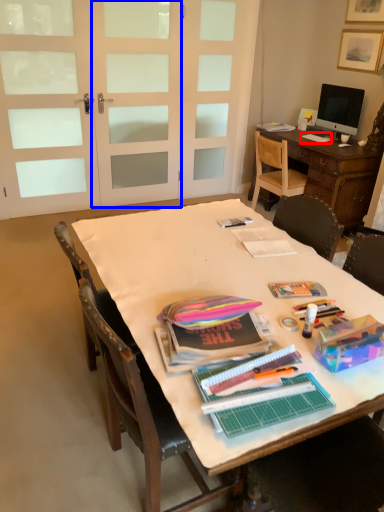
Question: Which of the following is the closest to the observer, notebook (highlighted by a red box) or screen door (highlighted by a blue box)?

Choices:
 (A) notebook
 (B) screen door

Answer: (B)